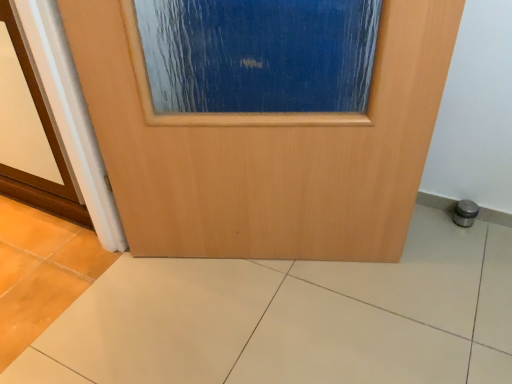
This screenshot has height=384, width=512. I want to click on free spot in front of wooden door at center, so click(x=272, y=324).